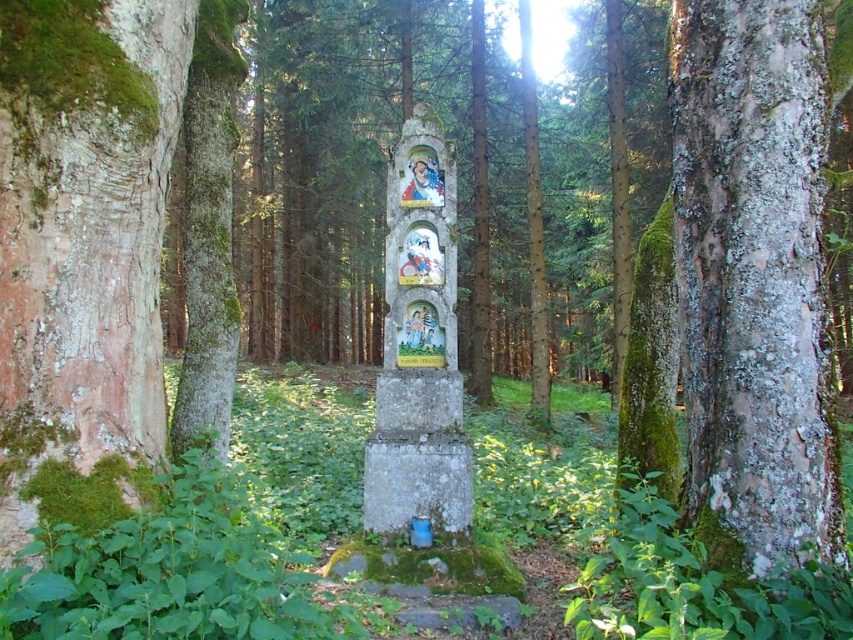
You are standing at the center of the forest scene near the stone shrine. You need to locate the speckled bark tree trunk at right. According to the coordinates provided, where exactly is it positioned?

The speckled bark tree trunk at right is located at point 0.442 on the x axis and 0.885 on the y axis.